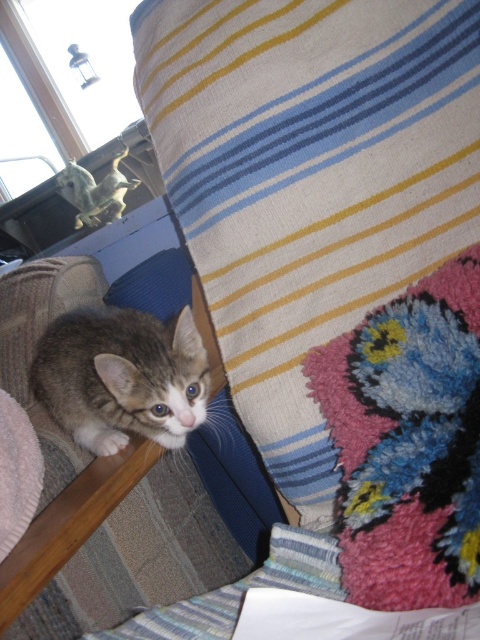
Question: Is striped woolen blanket at upper right wider than tabby fur cat at lower left?

Choices:
 (A) no
 (B) yes

Answer: (B)

Question: Is striped woolen blanket at upper right below tabby fur cat at lower left?

Choices:
 (A) no
 (B) yes

Answer: (A)

Question: Is the position of striped woolen blanket at upper right less distant than that of tabby fur cat at lower left?

Choices:
 (A) yes
 (B) no

Answer: (A)

Question: Which point appears farthest from the camera in this image?

Choices:
 (A) (162, 324)
 (B) (177, 184)

Answer: (A)

Question: Among these points, which one is nearest to the camera?

Choices:
 (A) (380, 100)
 (B) (107, 442)

Answer: (A)